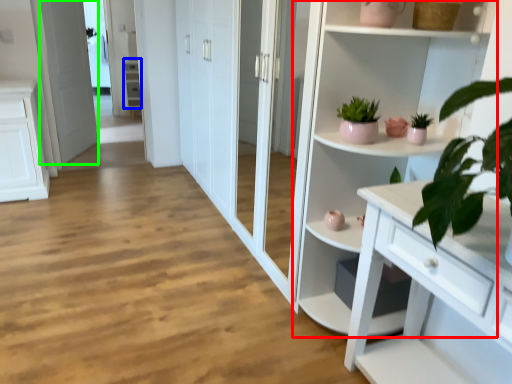
Question: Based on their relative distances, which object is farther from cupboard (highlighted by a red box)? Choose from cabinet (highlighted by a blue box) and screen door (highlighted by a green box).

Choices:
 (A) cabinet
 (B) screen door

Answer: (A)